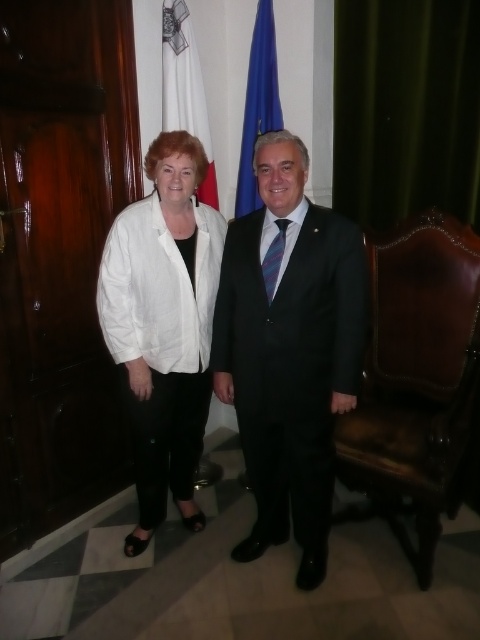
Question: Among these objects, which one is farthest from the camera?

Choices:
 (A) brown leather armchair at right
 (B) black suit at center
 (C) white fabric flag at upper left
 (D) white cotton blouse at center

Answer: (C)

Question: Which of the following is the closest to the observer?

Choices:
 (A) white cotton blouse at center
 (B) brown leather armchair at right
 (C) blue fabric flag at upper center
 (D) white fabric flag at upper left

Answer: (B)

Question: In this image, where is black suit at center located relative to brown leather armchair at right?

Choices:
 (A) above
 (B) below

Answer: (A)

Question: Does brown leather armchair at right appear over white fabric flag at upper left?

Choices:
 (A) yes
 (B) no

Answer: (B)

Question: Considering the real-world distances, which object is closest to the brown leather armchair at right?

Choices:
 (A) blue fabric flag at upper center
 (B) white fabric flag at upper left
 (C) black suit at center
 (D) white cotton blouse at center

Answer: (C)

Question: Where is white cotton blouse at center located in relation to blue fabric flag at upper center in the image?

Choices:
 (A) above
 (B) below

Answer: (B)